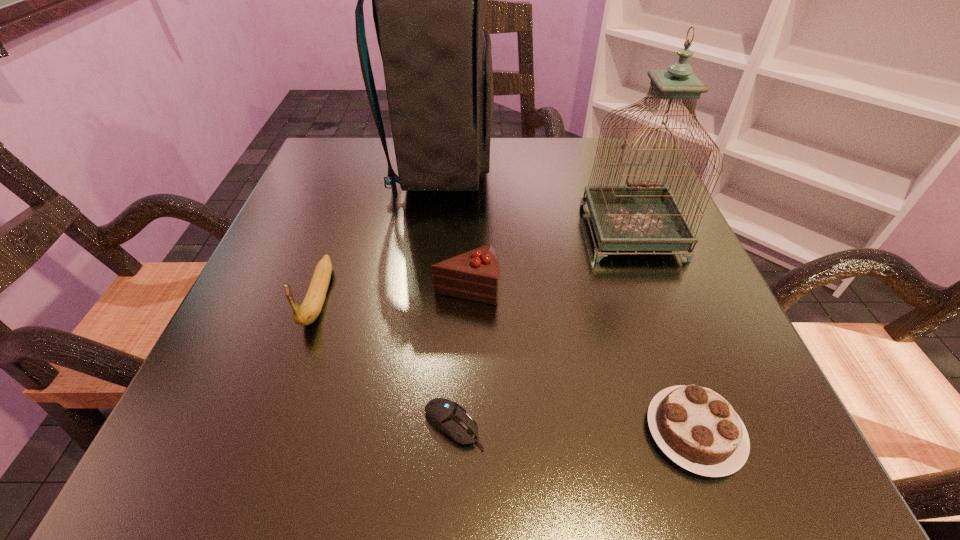
Locate an element on the screen. The image size is (960, 540). vacant area that satisfies the following two spatial constraints: 1. on the front-facing side of the farther chocolate cake; 2. on the left side of the tallest object is located at coordinates coord(426,287).

Where is `blank area in the image that satisfies the following two spatial constraints: 1. on the front-facing side of the tallest object; 2. on the right side of the shortest object`? The width and height of the screenshot is (960, 540). blank area in the image that satisfies the following two spatial constraints: 1. on the front-facing side of the tallest object; 2. on the right side of the shortest object is located at coordinates (410, 426).